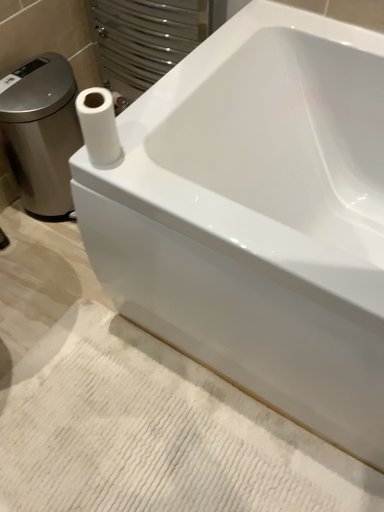
What do you see at coordinates (155, 433) in the screenshot? I see `white textured bath mat at lower center` at bounding box center [155, 433].

What are the coordinates of `white glossy porcelain at left` in the screenshot? It's located at (41, 132).

Does white textured bath mat at lower center have a larger size compared to white matte paper towel at upper left?

Yes.

Is the position of white textured bath mat at lower center less distant than that of white matte paper towel at upper left?

No, white textured bath mat at lower center is further to the viewer.

From the picture: Considering the sizes of white textured bath mat at lower center and white matte paper towel at upper left in the image, is white textured bath mat at lower center wider or thinner than white matte paper towel at upper left?

In the image, white textured bath mat at lower center appears to be wider than white matte paper towel at upper left.

Is white textured bath mat at lower center situated inside white matte paper towel at upper left or outside?

white textured bath mat at lower center cannot be found inside white matte paper towel at upper left.

Visually, is white glossy porcelain at left positioned to the left or to the right of white textured bath mat at lower center?

In the image, white glossy porcelain at left appears on the left side of white textured bath mat at lower center.

Does white glossy porcelain at left have a greater height compared to white textured bath mat at lower center?

Correct, white glossy porcelain at left is much taller as white textured bath mat at lower center.

From a real-world perspective, who is located higher, white glossy porcelain at left or white textured bath mat at lower center?

white glossy porcelain at left.

Is white glossy porcelain at left next to white textured bath mat at lower center and touching it?

They are not placed beside each other.

How much distance is there between white matte paper towel at upper left and white glossy porcelain at left?

21.46 inches.

Between white matte paper towel at upper left and white glossy porcelain at left, which one has larger size?

Bigger between the two is white glossy porcelain at left.

Which object is positioned more to the left, white matte paper towel at upper left or white glossy porcelain at left?

From the viewer's perspective, white glossy porcelain at left appears more on the left side.

Where is `porcelain behind the white matte paper towel at upper left`? Image resolution: width=384 pixels, height=512 pixels. porcelain behind the white matte paper towel at upper left is located at coordinates (41, 132).

Locate an element on the screen. This screenshot has height=512, width=384. bath mat on the right of white matte paper towel at upper left is located at coordinates (155, 433).

Can you confirm if white matte paper towel at upper left is smaller than white textured bath mat at lower center?

Correct, white matte paper towel at upper left occupies less space than white textured bath mat at lower center.

Considering their positions, is white matte paper towel at upper left located in front of or behind white textured bath mat at lower center?

Visually, white matte paper towel at upper left is located in front of white textured bath mat at lower center.

The width and height of the screenshot is (384, 512). I want to click on paper towel located below the white glossy porcelain at left (from the image's perspective), so click(x=99, y=126).

Considering the sizes of objects white glossy porcelain at left and white matte paper towel at upper left in the image provided, who is shorter, white glossy porcelain at left or white matte paper towel at upper left?

Standing shorter between the two is white matte paper towel at upper left.

From a real-world perspective, who is located lower, white glossy porcelain at left or white matte paper towel at upper left?

white glossy porcelain at left is physically lower.

Measure the distance from white glossy porcelain at left to white matte paper towel at upper left.

21.46 inches.

Considering the sizes of objects white textured bath mat at lower center and white glossy porcelain at left in the image provided, who is shorter, white textured bath mat at lower center or white glossy porcelain at left?

With less height is white textured bath mat at lower center.

From a real-world perspective, is white textured bath mat at lower center under white glossy porcelain at left?

Indeed, from a real-world perspective, white textured bath mat at lower center is positioned beneath white glossy porcelain at left.

Does white textured bath mat at lower center have a smaller size compared to white glossy porcelain at left?

Correct, white textured bath mat at lower center occupies less space than white glossy porcelain at left.

Which is in front, white textured bath mat at lower center or white glossy porcelain at left?

white textured bath mat at lower center is more forward.

In order to click on paper towel above the white textured bath mat at lower center (from a real-world perspective) in this screenshot , I will do `click(99, 126)`.

Locate an element on the screen. This screenshot has height=512, width=384. bath mat below the white glossy porcelain at left (from the image's perspective) is located at coordinates (155, 433).

Which object lies nearer to the anchor point white matte paper towel at upper left, white textured bath mat at lower center or white glossy porcelain at left?

white glossy porcelain at left is positioned closer to the anchor white matte paper towel at upper left.

Which object lies further to the anchor point white glossy porcelain at left, white textured bath mat at lower center or white matte paper towel at upper left?

white textured bath mat at lower center is further to white glossy porcelain at left.

Based on their spatial positions, is white matte paper towel at upper left or white glossy porcelain at left further from white textured bath mat at lower center?

Based on the image, white glossy porcelain at left appears to be further to white textured bath mat at lower center.

Estimate the real-world distances between objects in this image. Which object is further from white textured bath mat at lower center, white glossy porcelain at left or white matte paper towel at upper left?

white glossy porcelain at left lies further to white textured bath mat at lower center than the other object.

When comparing their distances from white glossy porcelain at left, does white matte paper towel at upper left or white textured bath mat at lower center seem further?

Among the two, white textured bath mat at lower center is located further to white glossy porcelain at left.

Looking at the image, which one is located closer to white matte paper towel at upper left, white glossy porcelain at left or white textured bath mat at lower center?

white glossy porcelain at left is closer to white matte paper towel at upper left.

Where is `paper towel between white glossy porcelain at left and white textured bath mat at lower center vertically`? The image size is (384, 512). paper towel between white glossy porcelain at left and white textured bath mat at lower center vertically is located at coordinates (99, 126).